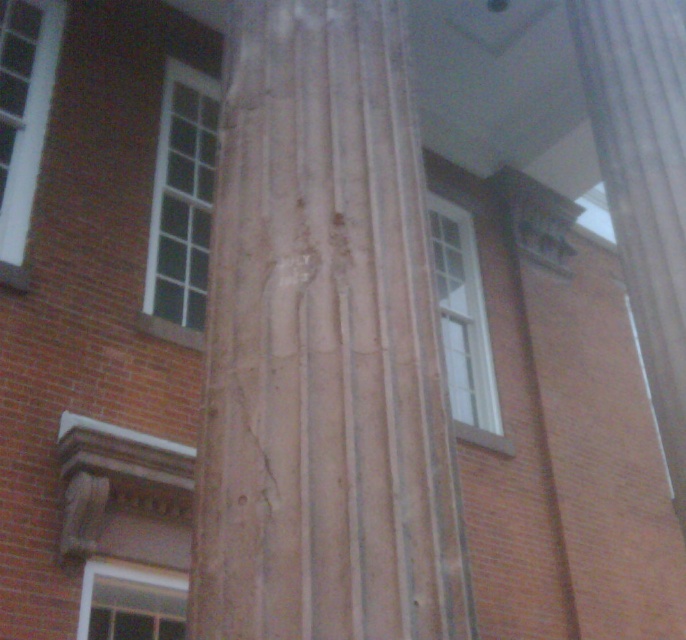
You are standing in front of a building and see both the smooth brown column at center and the smooth stone column at center. Which column would appear larger to you?

The smooth brown column at center appears larger because it is closer to the viewer than the smooth stone column at center.

In the scene shown: You are standing in front of a building and see a point marked at coordinates (x=322, y=346). Based on the scene description, what object does this point most likely belong to?

The point at coordinates (x=322, y=346) corresponds to the smooth brown column at center.

Looking at this image, you are an architect examining the building facade. You notice the smooth brown column at center and the smooth stone column at center. Which one is positioned lower on the facade?

The smooth brown column at center is located below the smooth stone column at center, so it is positioned lower on the facade.